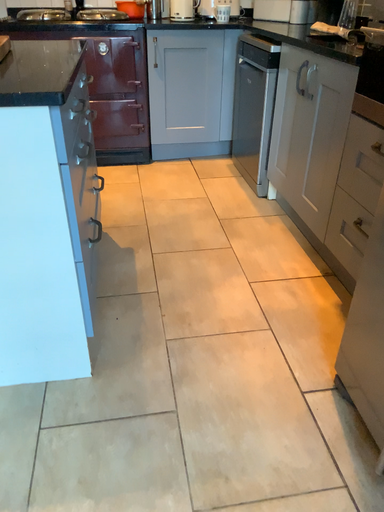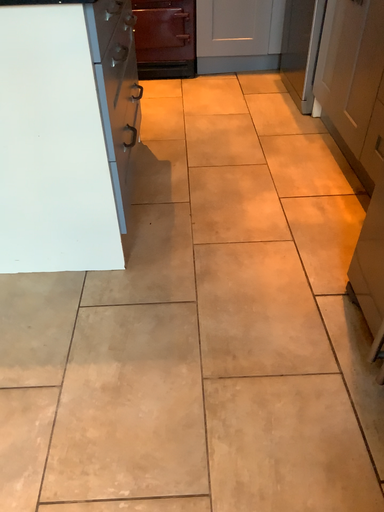
Question: Which way did the camera rotate in the video?

Choices:
 (A) rotated left
 (B) rotated right

Answer: (A)